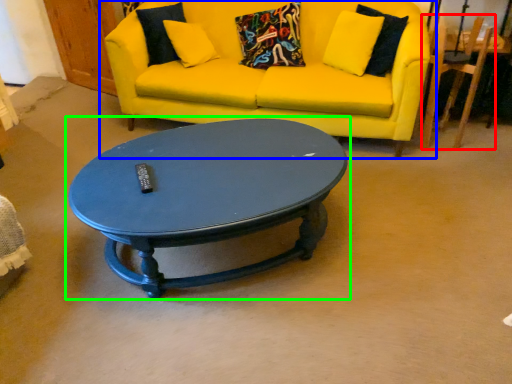
Question: Which is nearer to the armchair (highlighted by a red box)? studio couch (highlighted by a blue box) or coffee table (highlighted by a green box).

Choices:
 (A) studio couch
 (B) coffee table

Answer: (A)